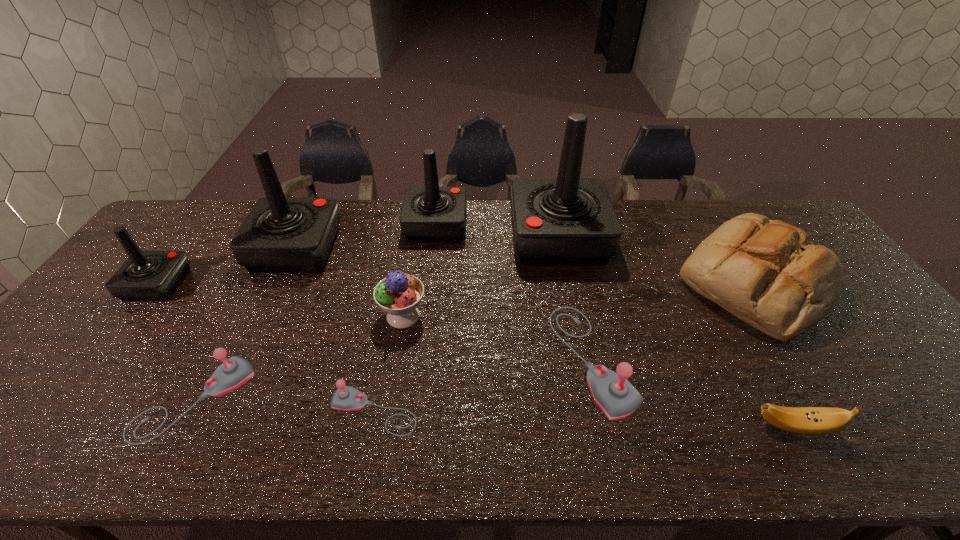
Locate an element on the screen. The width and height of the screenshot is (960, 540). blank space located 0.400m on the front-facing side of the third red joystick from right to left is located at coordinates (461, 248).

Locate an element on the screen. This screenshot has width=960, height=540. free point located 0.200m on the front-facing side of the eighth shortest object is located at coordinates (525, 225).

In order to click on free location located on the front-facing side of the leftmost joystick in this screenshot , I will do (286, 285).

The width and height of the screenshot is (960, 540). Identify the location of vacant space located on the back of the bread. (704, 204).

Locate an element on the screen. Image resolution: width=960 pixels, height=540 pixels. free location located 0.130m on the right of the icecream is located at coordinates (474, 316).

You are a GUI agent. You are given a task and a screenshot of the screen. Output one action in this format:
    pyautogui.click(x=<x>, y=<y>)
    Task: Click on the free space located 0.360m on the left of the seventh tallest object
    
    Given the screenshot: What is the action you would take?
    pyautogui.click(x=412, y=359)

Image resolution: width=960 pixels, height=540 pixels. What are the coordinates of `free space located 0.170m on the back of the second shortest joystick` in the screenshot? It's located at (242, 309).

Where is `vacant space located 0.140m on the right of the yellow banana`? This screenshot has width=960, height=540. vacant space located 0.140m on the right of the yellow banana is located at coordinates (896, 427).

The height and width of the screenshot is (540, 960). I want to click on vacant space located 0.180m on the right of the second gray joystick from right to left, so click(497, 411).

In order to click on bread that is at the far edge in this screenshot , I will do `click(767, 273)`.